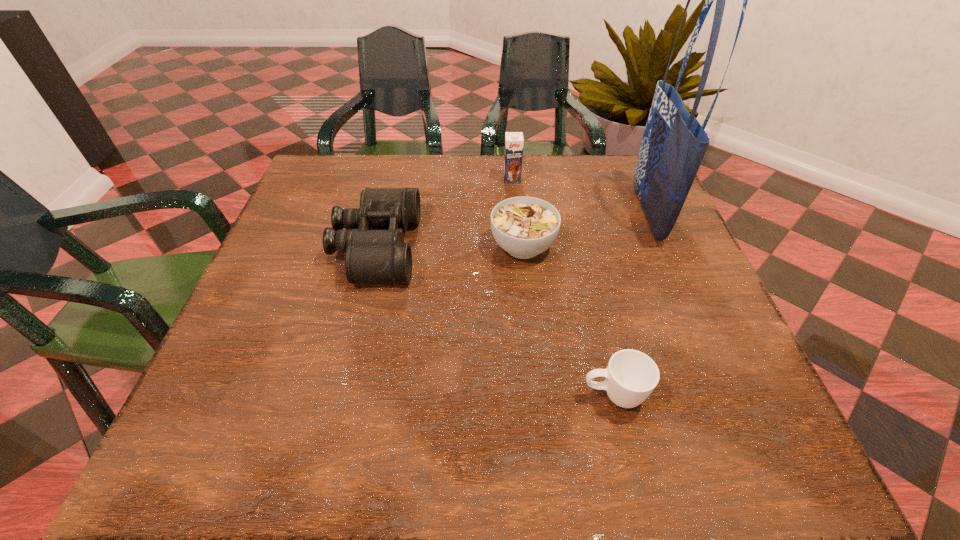
The image size is (960, 540). I want to click on object located at the right edge, so pos(674,143).

At what (x,y) coordinates should I click in order to perform the action: click on object that is at the far right corner. Please return your answer as a coordinate pair (x, y). This screenshot has height=540, width=960. Looking at the image, I should click on (674, 143).

Locate an element on the screen. vacant area at the far edge is located at coordinates (385, 170).

Locate an element on the screen. This screenshot has height=540, width=960. vacant space at the near edge of the desktop is located at coordinates [394, 463].

You are a GUI agent. You are given a task and a screenshot of the screen. Output one action in this format:
    pyautogui.click(x=<x>, y=<y>)
    Task: Click on the vacant space at the left edge of the desktop
    
    Given the screenshot: What is the action you would take?
    pyautogui.click(x=310, y=348)

Where is `free space at the right edge`? Image resolution: width=960 pixels, height=540 pixels. free space at the right edge is located at coordinates (739, 372).

The height and width of the screenshot is (540, 960). I want to click on free region at the far left corner, so click(x=322, y=173).

Locate an element on the screen. The image size is (960, 540). free space at the near left corner is located at coordinates (184, 451).

Locate an element on the screen. The width and height of the screenshot is (960, 540). free location at the far right corner of the desktop is located at coordinates (605, 157).

At what (x,y) coordinates should I click in order to perform the action: click on vacant space at the near right corner of the desktop. Please return your answer as a coordinate pair (x, y). The height and width of the screenshot is (540, 960). Looking at the image, I should click on (689, 457).